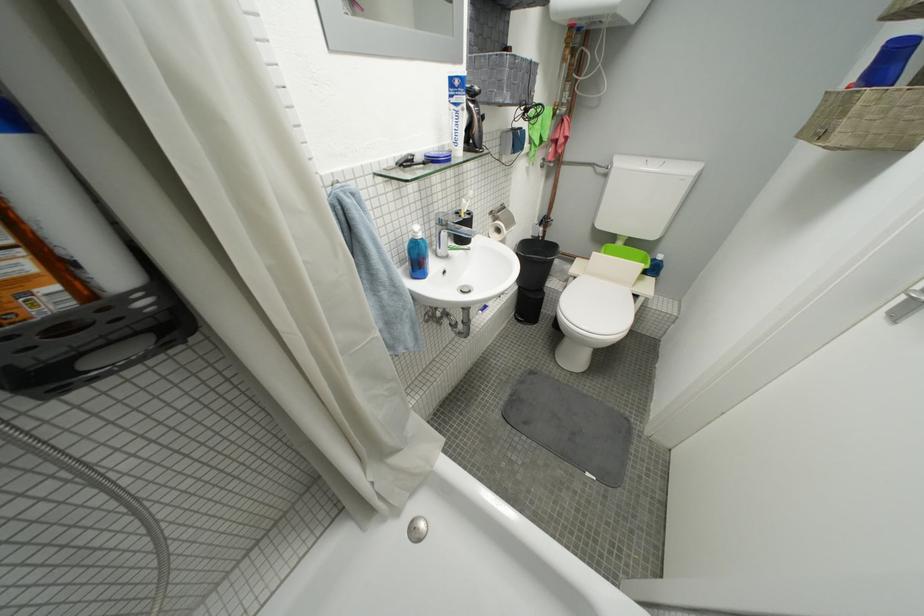
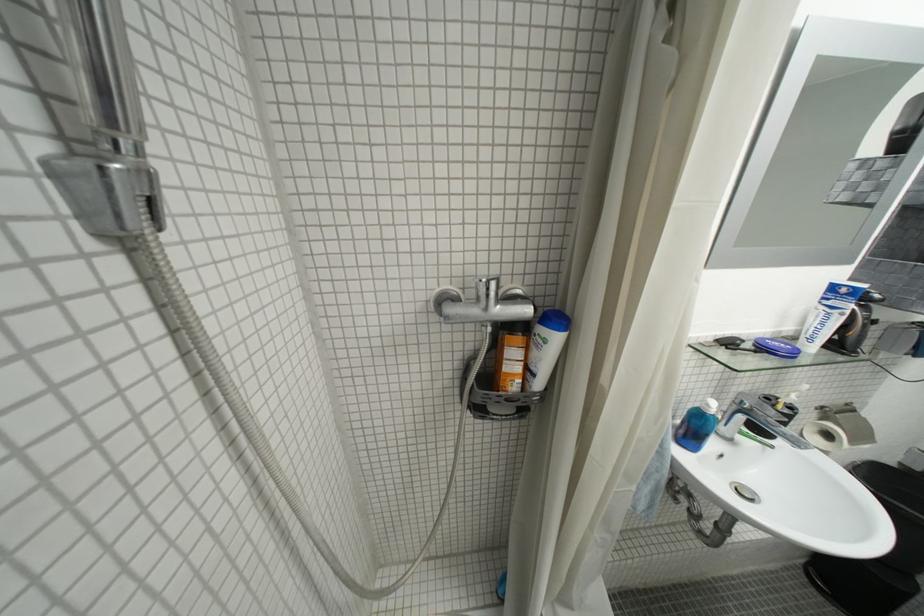
The point at (421, 156) is marked in the first image. Where is the corresponding point in the second image?

(751, 342)